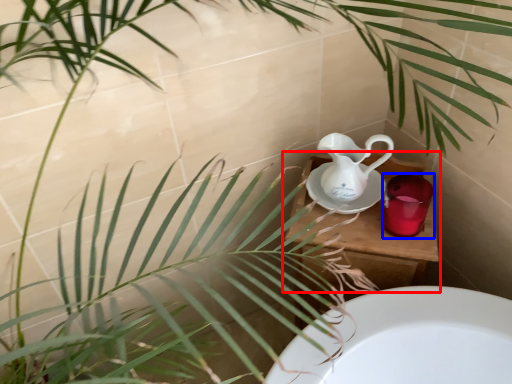
Question: Which object is further to the camera taking this photo, table (highlighted by a red box) or mug (highlighted by a blue box)?

Choices:
 (A) table
 (B) mug

Answer: (A)